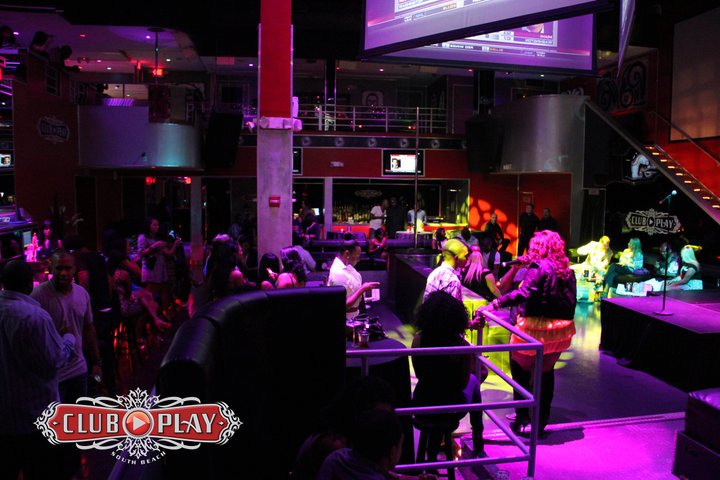
At what (x,y) coordinates should I click in order to perform the action: click on stairs. Please return your answer as a coordinate pair (x, y). Looking at the image, I should click on point(680,176).